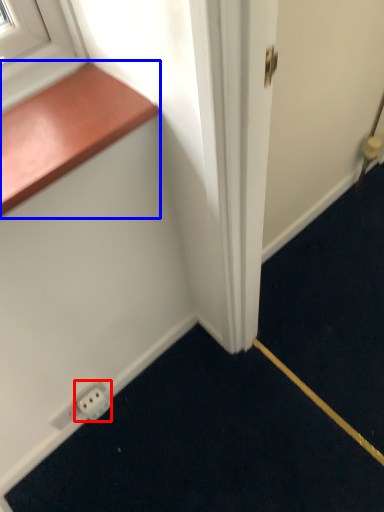
Question: Which object is further to the camera taking this photo, electric outlet (highlighted by a red box) or window sill (highlighted by a blue box)?

Choices:
 (A) electric outlet
 (B) window sill

Answer: (A)